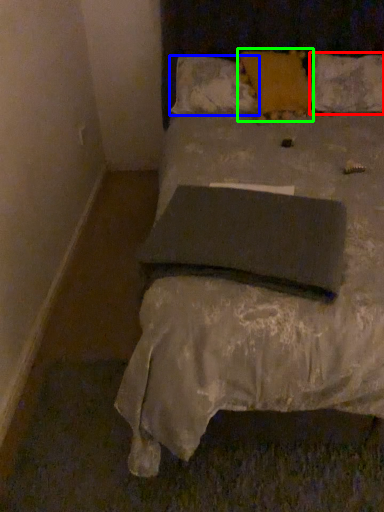
Question: Which object is the farthest from pillow (highlighted by a red box)? Choose among these: pillow (highlighted by a blue box) or pillow (highlighted by a green box).

Choices:
 (A) pillow
 (B) pillow

Answer: (A)